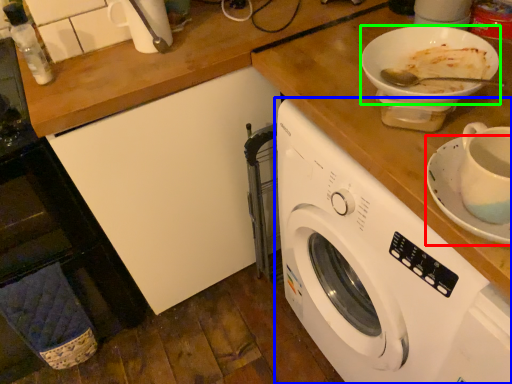
Question: Which object is the closest to the saucer (highlighted by a red box)? Choose among these: washing machine (highlighted by a blue box) or tableware (highlighted by a green box).

Choices:
 (A) washing machine
 (B) tableware

Answer: (B)